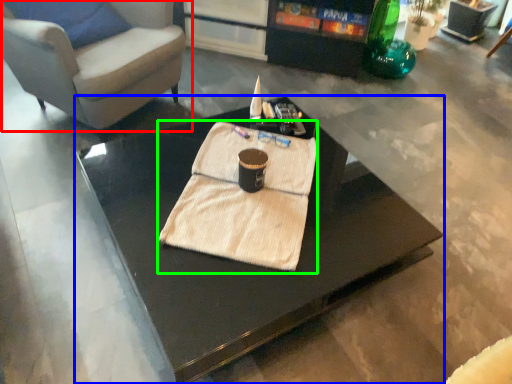
Question: Based on their relative distances, which object is nearer to chair (highlighted by a red box)? Choose from coffee table (highlighted by a blue box) and blanket (highlighted by a green box).

Choices:
 (A) coffee table
 (B) blanket

Answer: (A)